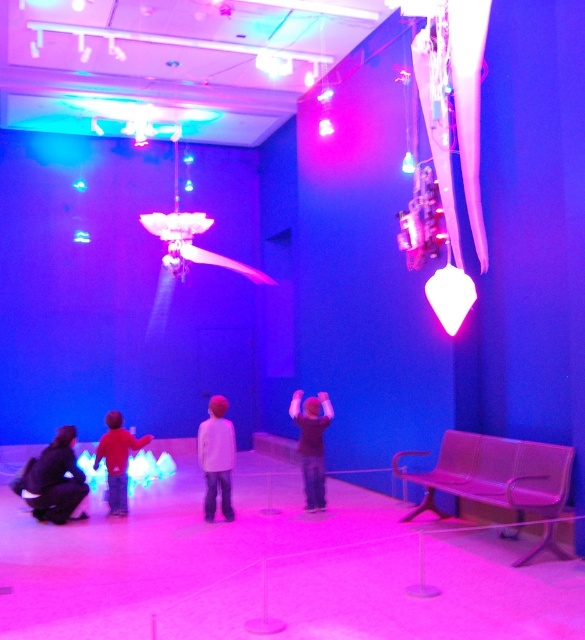
You are designing a photo shoot and need to place the black matte shirt at center and the red cotton shirt at lower left in a way that accounts for their sizes. Which shirt should you position closer to the camera to make them appear the same size in the final image?

The black matte shirt at center has a lesser width compared to the red cotton shirt at lower left. To make them appear the same size in the photo, position the black matte shirt at center closer to the camera than the red cotton shirt at lower left.

You are a photographer setting up a shoot in this futuristic room. You need to place a prop on the dark gray fabric at lower left and another prop on the white matte shirt at center. Which prop placement will be lower in the image?

The dark gray fabric at lower left is located below the white matte shirt at center, so placing a prop on the dark gray fabric at lower left will be lower in the image.